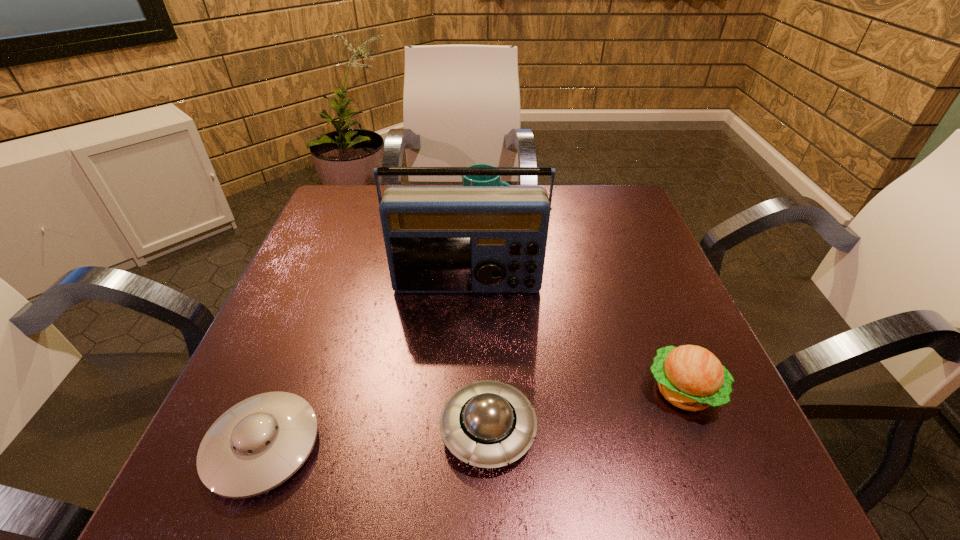
This screenshot has height=540, width=960. Identify the location of unoccupied position between the taller saucer and the tallest object. (477, 357).

Identify the location of vacant area between the right saucer and the left saucer. This screenshot has width=960, height=540. (375, 438).

You are a GUI agent. You are given a task and a screenshot of the screen. Output one action in this format:
    pyautogui.click(x=<x>, y=<y>)
    Task: Click on the free spot between the taller saucer and the tallest object
    
    Given the screenshot: What is the action you would take?
    pyautogui.click(x=477, y=357)

Identify which object is the fourth nearest to the tallest object. Please provide its 2D coordinates. Your answer should be formatted as a tuple, i.e. [(x, y)], where the tuple contains the x and y coordinates of a point satisfying the conditions above.

[(259, 443)]

The height and width of the screenshot is (540, 960). Identify the location of object that stands as the third closest to the shortest object. click(690, 377).

You are a GUI agent. You are given a task and a screenshot of the screen. Output one action in this format:
    pyautogui.click(x=<x>, y=<y>)
    Task: Click on the vacant space that satisfies the following two spatial constraints: 1. on the front panel of the second farthest object; 2. on the left side of the right saucer
    The image size is (960, 540).
    Given the screenshot: What is the action you would take?
    pyautogui.click(x=463, y=429)

Image resolution: width=960 pixels, height=540 pixels. I want to click on free space that satisfies the following two spatial constraints: 1. on the handle side of the farthest object; 2. on the front panel of the radio receiver, so click(x=489, y=286).

You are a GUI agent. You are given a task and a screenshot of the screen. Output one action in this format:
    pyautogui.click(x=<x>, y=<y>)
    Task: Click on the vacant position in the image that satisfies the following two spatial constraints: 1. on the front panel of the fourth nearest object; 2. on the left side of the hamburger
    
    Given the screenshot: What is the action you would take?
    pyautogui.click(x=464, y=391)

Where is `free spot that satisfies the following two spatial constraints: 1. on the front panel of the radio receiver; 2. on the left side of the second shortest object`? This screenshot has width=960, height=540. free spot that satisfies the following two spatial constraints: 1. on the front panel of the radio receiver; 2. on the left side of the second shortest object is located at coordinates tap(463, 429).

Find the location of a particular element. The width and height of the screenshot is (960, 540). vacant space that satisfies the following two spatial constraints: 1. on the back side of the third shortest object; 2. on the left side of the left saucer is located at coordinates (285, 391).